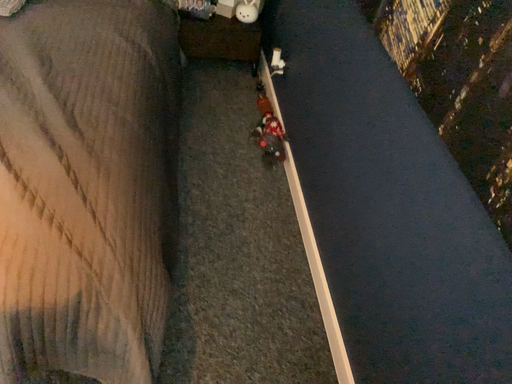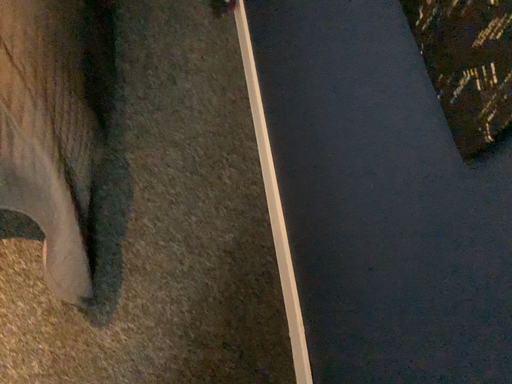
Question: Which way did the camera rotate in the video?

Choices:
 (A) rotated downward
 (B) rotated upward

Answer: (A)